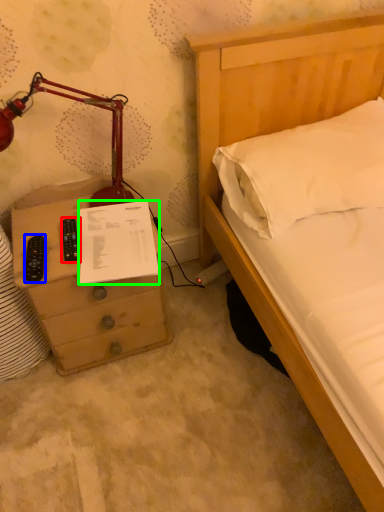
Question: Considering the real-world distances, which object is closest to control (highlighted by a red box)? remote (highlighted by a blue box) or document (highlighted by a green box).

Choices:
 (A) remote
 (B) document

Answer: (A)